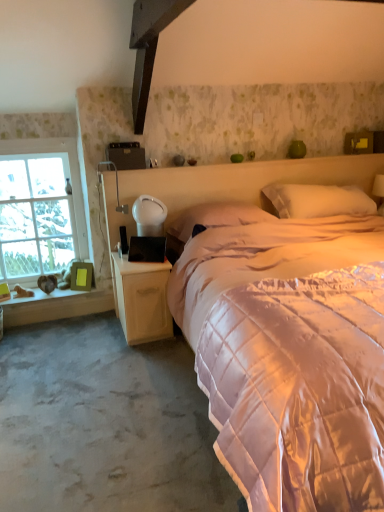
Question: From the image's perspective, is matte white table lamp at left, which is the second table lamp in right-to-left order, on top of clear glass window at left?

Choices:
 (A) yes
 (B) no

Answer: (A)

Question: Does matte white table lamp at left, which is the second table lamp in right-to-left order, have a larger size compared to clear glass window at left?

Choices:
 (A) no
 (B) yes

Answer: (A)

Question: Considering the relative sizes of matte white table lamp at left, positioned as the 1th table lamp in left-to-right order, and clear glass window at left in the image provided, is matte white table lamp at left, positioned as the 1th table lamp in left-to-right order, shorter than clear glass window at left?

Choices:
 (A) no
 (B) yes

Answer: (B)

Question: Is matte white table lamp at left, which is the second table lamp in right-to-left order, wider than clear glass window at left?

Choices:
 (A) no
 (B) yes

Answer: (B)

Question: Is matte white table lamp at left, positioned as the 1th table lamp in left-to-right order, taller than clear glass window at left?

Choices:
 (A) yes
 (B) no

Answer: (B)

Question: Is matte white table lamp at left, positioned as the 1th table lamp in left-to-right order, next to clear glass window at left?

Choices:
 (A) yes
 (B) no

Answer: (B)

Question: Considering the relative sizes of wooden nightstand at lower left and silky white pillow at center, which appears as the 2th pillow when viewed from the right, in the image provided, is wooden nightstand at lower left thinner than silky white pillow at center, which appears as the 2th pillow when viewed from the right,?

Choices:
 (A) no
 (B) yes

Answer: (A)

Question: From the image's perspective, would you say wooden nightstand at lower left is positioned over silky white pillow at center, which appears as the 2th pillow when viewed from the right?

Choices:
 (A) yes
 (B) no

Answer: (B)

Question: Could you tell me if wooden nightstand at lower left is turned towards silky white pillow at center, the first pillow in the left-to-right sequence?

Choices:
 (A) yes
 (B) no

Answer: (B)

Question: Can you confirm if wooden nightstand at lower left is bigger than silky white pillow at center, which appears as the 2th pillow when viewed from the right?

Choices:
 (A) yes
 (B) no

Answer: (A)

Question: Considering the relative positions of wooden nightstand at lower left and silky white pillow at center, the first pillow in the left-to-right sequence, in the image provided, is wooden nightstand at lower left to the left of silky white pillow at center, the first pillow in the left-to-right sequence, from the viewer's perspective?

Choices:
 (A) yes
 (B) no

Answer: (A)

Question: From the image's perspective, is wooden nightstand at lower left located beneath silky white pillow at center, which appears as the 2th pillow when viewed from the right?

Choices:
 (A) no
 (B) yes

Answer: (B)

Question: From the image's perspective, is woodenwoodenwindow sill at left beneath white quilted pillow at upper center, the first pillow in the right-to-left sequence?

Choices:
 (A) no
 (B) yes

Answer: (B)